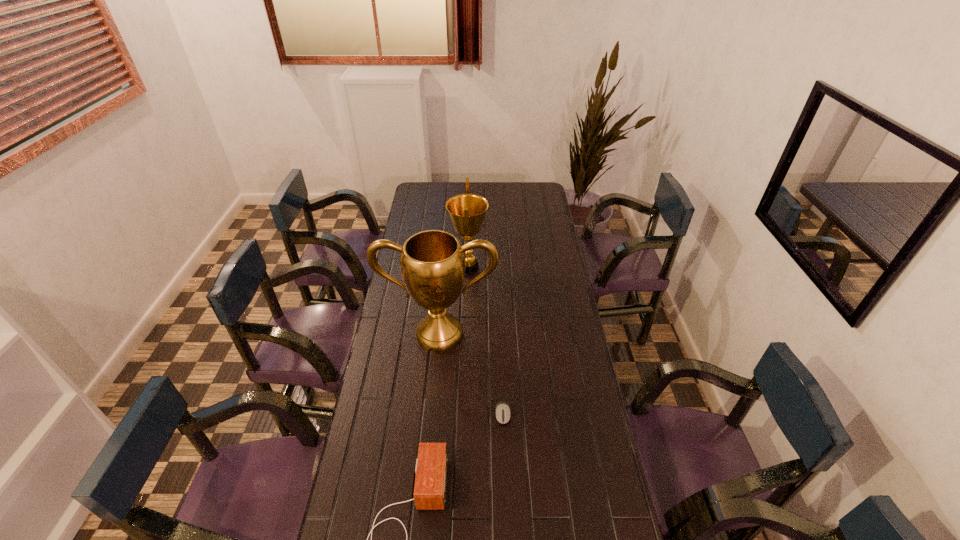
Where is `vacant region at the far right corner`? Image resolution: width=960 pixels, height=540 pixels. vacant region at the far right corner is located at coordinates (521, 201).

I want to click on vacant point located between the computer equipment and the award, so click(x=486, y=341).

The width and height of the screenshot is (960, 540). What are the coordinates of `vacant space in between the farthest object and the computer equipment` in the screenshot? It's located at (486, 341).

Where is `object that is the nearest to the trophy cup`? This screenshot has height=540, width=960. object that is the nearest to the trophy cup is located at coordinates (467, 211).

Identify the location of object that is the third closest to the radio receiver. This screenshot has height=540, width=960. (467, 211).